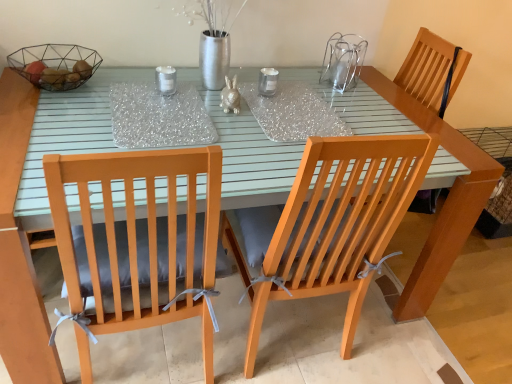
Locate an element on the screen. The width and height of the screenshot is (512, 384). free location to the right of metallic wire basket at upper left is located at coordinates (115, 88).